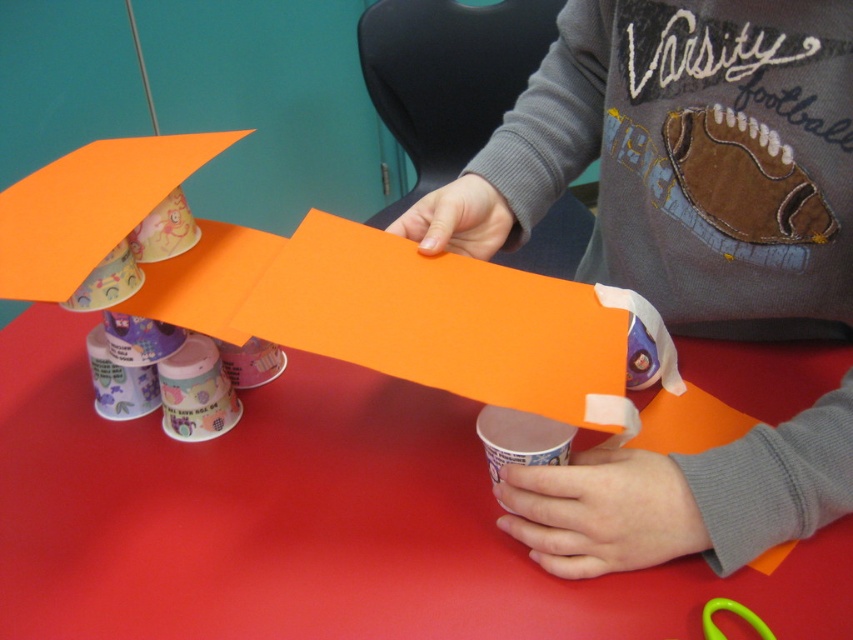
You are a child who wants to place a 20 inch ruler on the red paper table at center. Can you do that?

The red paper table at center and viewer are 19.89 inches apart, so the ruler cannot be placed on the table because it is too far away from you.

You are a teacher observing a craft activity. You notice the red paper table at center and the white paper cup at center. Which object is positioned lower in the image?

The red paper table at center is positioned below the white paper cup at center, so it is lower in the image.

You are a teacher observing a child crafting a paper airplane. The child has a white paper cup at center and green plastic scissors at lower right on the table. Which object is located higher on the table?

The white paper cup at center is positioned over the green plastic scissors at lower right, so it is higher on the table.